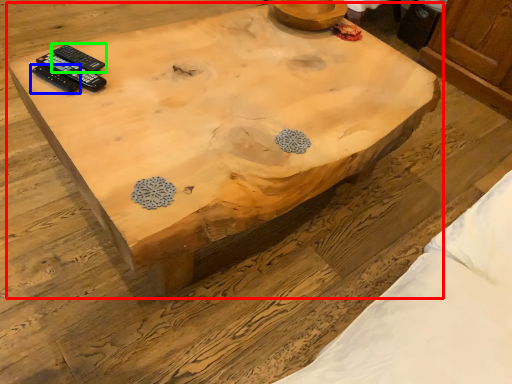
Question: Which is nearer to the coffee table (highlighted by a red box)? remote control (highlighted by a blue box) or remote control (highlighted by a green box).

Choices:
 (A) remote control
 (B) remote control

Answer: (B)